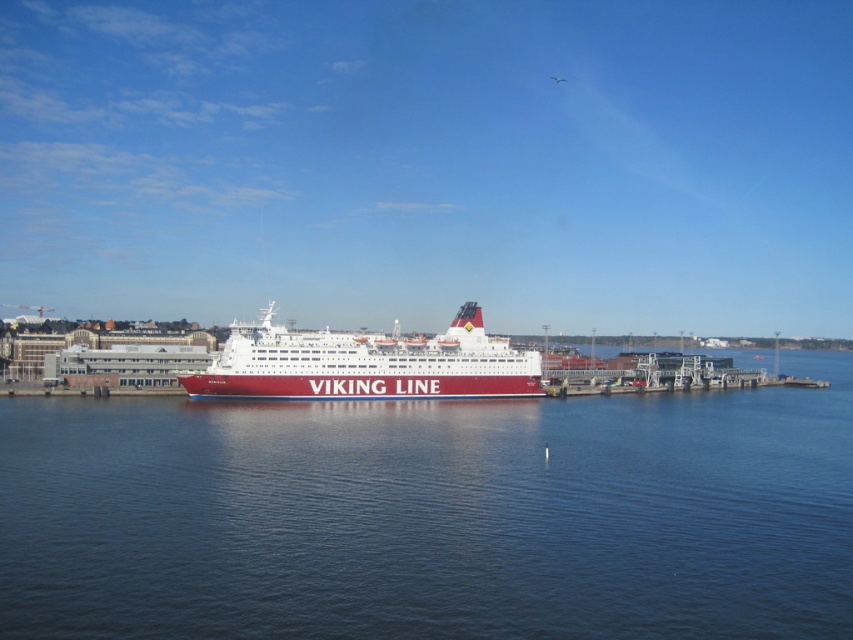
Question: In this image, where is blue water at center located relative to white glossy cruise ship at center?

Choices:
 (A) below
 (B) above

Answer: (A)

Question: Which point is closer to the camera taking this photo?

Choices:
 (A) (355, 378)
 (B) (527, 568)

Answer: (B)

Question: Which point is closer to the camera?

Choices:
 (A) white glossy cruise ship at center
 (B) blue water at center

Answer: (B)

Question: From the image, what is the correct spatial relationship of blue water at center in relation to white glossy cruise ship at center?

Choices:
 (A) above
 (B) below

Answer: (B)

Question: Does blue water at center have a lesser width compared to white glossy cruise ship at center?

Choices:
 (A) yes
 (B) no

Answer: (B)

Question: Which of the following is the farthest from the observer?

Choices:
 (A) (433, 355)
 (B) (830, 371)

Answer: (B)